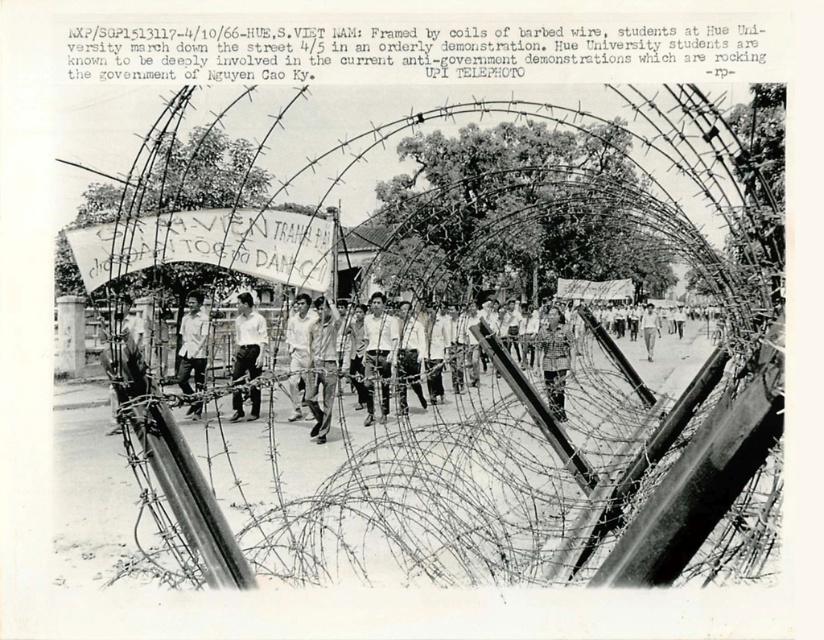
Does wire at center lie behind light gray uniform at center?

No.

Between wire at center and light gray uniform at center, which one appears on the left side from the viewer's perspective?

Positioned to the left is light gray uniform at center.

Does point (462, 280) come in front of point (293, 397)?

No.

The height and width of the screenshot is (640, 824). I want to click on wire at center, so click(531, 342).

Is point (611, 332) in front of point (311, 392)?

No, (611, 332) is behind (311, 392).

Who is positioned more to the right, wire at center or light brown leather jacket at center?

wire at center is more to the right.

Is point (776, 262) farther from viewer compared to point (331, 385)?

That is False.

Find the location of `wire at center`. wire at center is located at coordinates (531, 342).

Is point (722, 211) in front of point (551, 404)?

Yes, it is in front of point (551, 404).

Which is in front, point (405, 467) or point (546, 385)?

Positioned in front is point (405, 467).

Between point (680, 230) and point (564, 360), which one is positioned in front?

Point (680, 230)

Where is `wire at center`? wire at center is located at coordinates (531, 342).